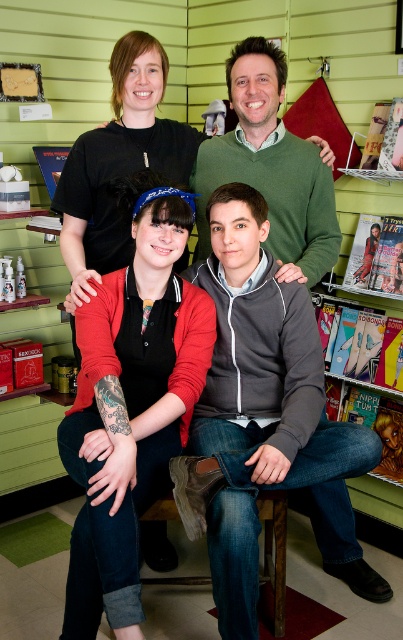
You are a store employee who needs to arrange the items on the shelf according to their colors. You see the red matte cardigan at center and the green wool sweater at upper center. Which item should you place lower on the shelf?

The red matte cardigan at center is located below the green wool sweater at upper center, so you should place the red matte cardigan at center lower on the shelf than the green wool sweater at upper center.